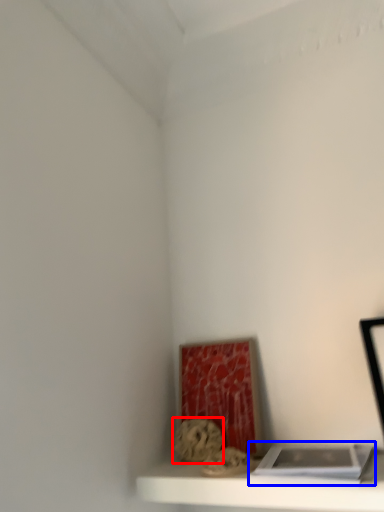
Question: Among these objects, which one is farthest to the camera, art (highlighted by a red box) or book (highlighted by a blue box)?

Choices:
 (A) art
 (B) book

Answer: (A)